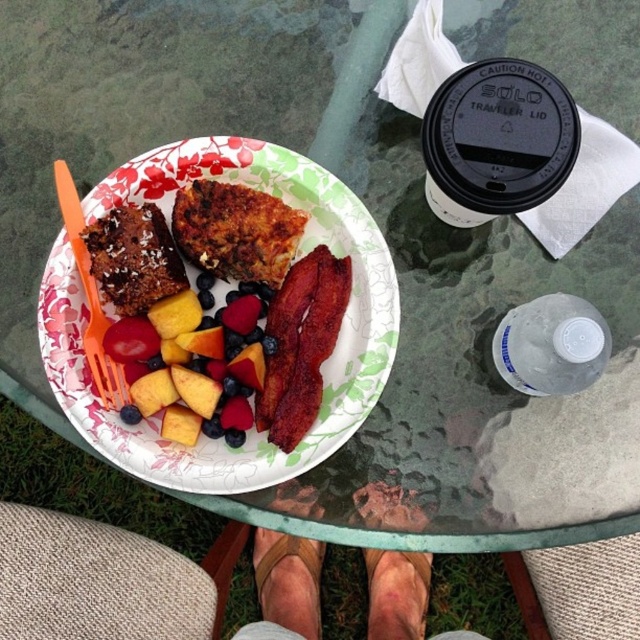
Is golden brown crispy hash brown at center below orange plastic fork at upper left?

Actually, golden brown crispy hash brown at center is above orange plastic fork at upper left.

Between golden brown crispy hash brown at center and orange plastic fork at upper left, which one has more height?

Standing taller between the two is orange plastic fork at upper left.

At what (x,y) coordinates should I click in order to perform the action: click on golden brown crispy hash brown at center. Please return your answer as a coordinate pair (x, y). Looking at the image, I should click on (236, 230).

At what (x,y) coordinates should I click in order to perform the action: click on golden brown crispy hash brown at center. Please return your answer as a coordinate pair (x, y). Looking at the image, I should click on (236, 230).

From the picture: Is brown crispy bacon at center positioned at the back of golden brown crispy hash brown at center?

No.

The width and height of the screenshot is (640, 640). In order to click on brown crispy bacon at center in this screenshot , I will do pos(301,344).

Describe the element at coordinates (301, 344) in the screenshot. The image size is (640, 640). I see `brown crispy bacon at center` at that location.

This screenshot has width=640, height=640. What are the coordinates of `brown crispy bacon at center` in the screenshot? It's located at tap(301, 344).

Where is `matte paper plate at center`? The width and height of the screenshot is (640, 640). matte paper plate at center is located at coordinates (323, 364).

Between matte paper plate at center and brown crispy bacon at center, which one has less height?

brown crispy bacon at center is shorter.

Is point (371, 248) less distant than point (294, 300)?

Yes.

In order to click on matte paper plate at center in this screenshot , I will do (323, 364).